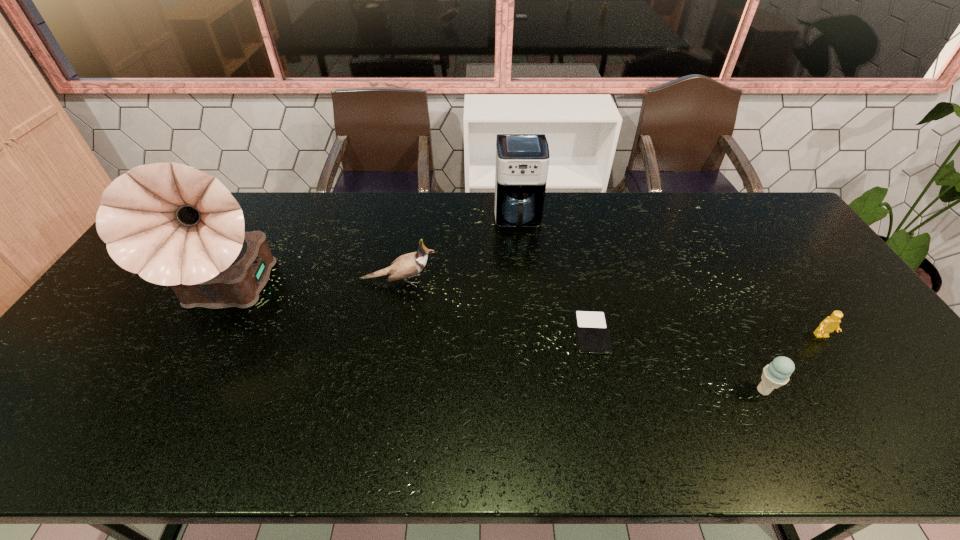
Find the location of a particular element. free space that satisfies the following two spatial constraints: 1. at the face of the third tallest object; 2. on the left side of the fifth object from left to right is located at coordinates (378, 390).